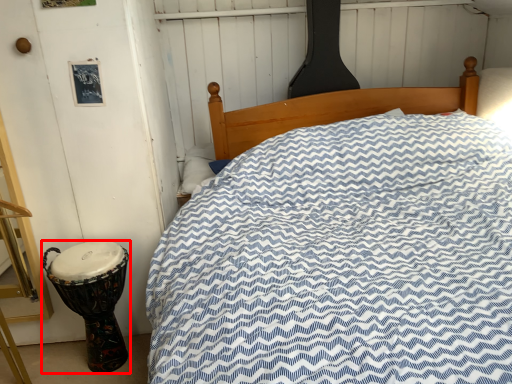
Question: Observing the image, what is the correct spatial positioning of drum (annotated by the red box) in reference to pillow?

Choices:
 (A) left
 (B) right

Answer: (A)